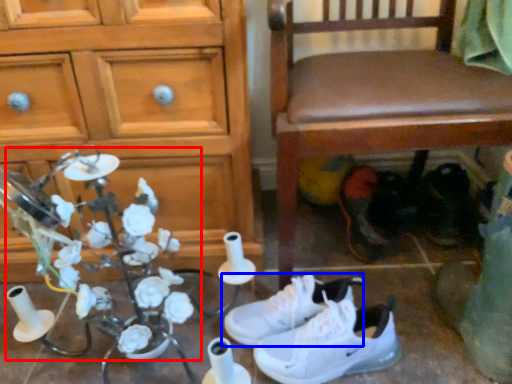
Question: Among these objects, which one is nearest to the camera, floral arrangement (highlighted by a red box) or footwear (highlighted by a blue box)?

Choices:
 (A) floral arrangement
 (B) footwear

Answer: (A)